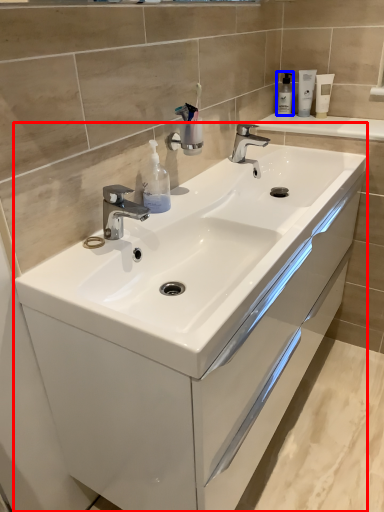
Question: Which point is closer to the camera, bathroom cabinet (highlighted by a red box) or soap dispenser (highlighted by a blue box)?

Choices:
 (A) bathroom cabinet
 (B) soap dispenser

Answer: (A)